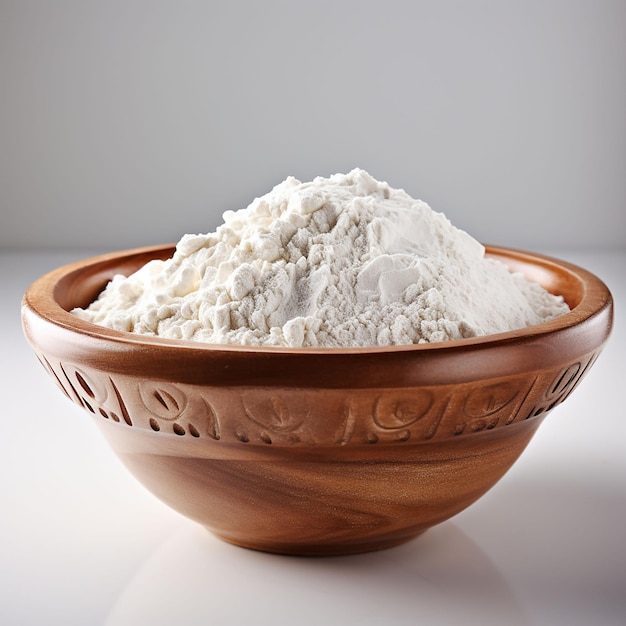
This screenshot has height=626, width=626. I want to click on wall, so click(129, 143).